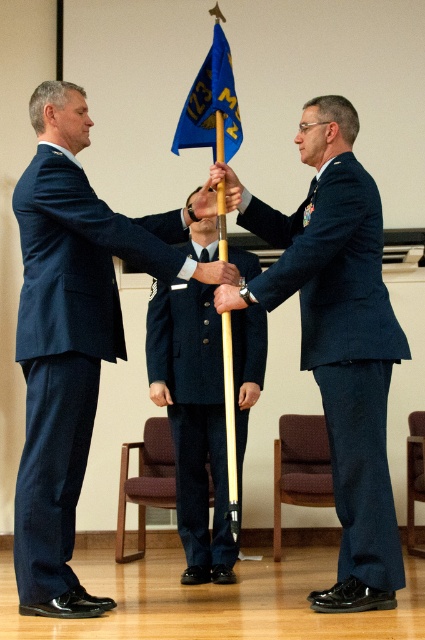
Question: Among these objects, which one is farthest from the camera?

Choices:
 (A) navy wool suit at left
 (B) blue fabric flag at upper center
 (C) navy blue uniform at center

Answer: (C)

Question: Does navy blue fabric uniform at center have a larger size compared to navy blue uniform at center?

Choices:
 (A) yes
 (B) no

Answer: (A)

Question: Estimate the real-world distances between objects in this image. Which object is closer to the navy blue fabric uniform at center?

Choices:
 (A) blue fabric flag at upper center
 (B) navy wool suit at left
 (C) navy blue uniform at center

Answer: (B)

Question: Does navy wool suit at left have a greater width compared to navy blue uniform at center?

Choices:
 (A) yes
 (B) no

Answer: (A)

Question: In this image, where is navy wool suit at left located relative to navy blue fabric uniform at center?

Choices:
 (A) right
 (B) left

Answer: (B)

Question: Which of the following is the closest to the observer?

Choices:
 (A) navy blue fabric uniform at center
 (B) navy wool suit at left
 (C) blue fabric flag at upper center

Answer: (B)